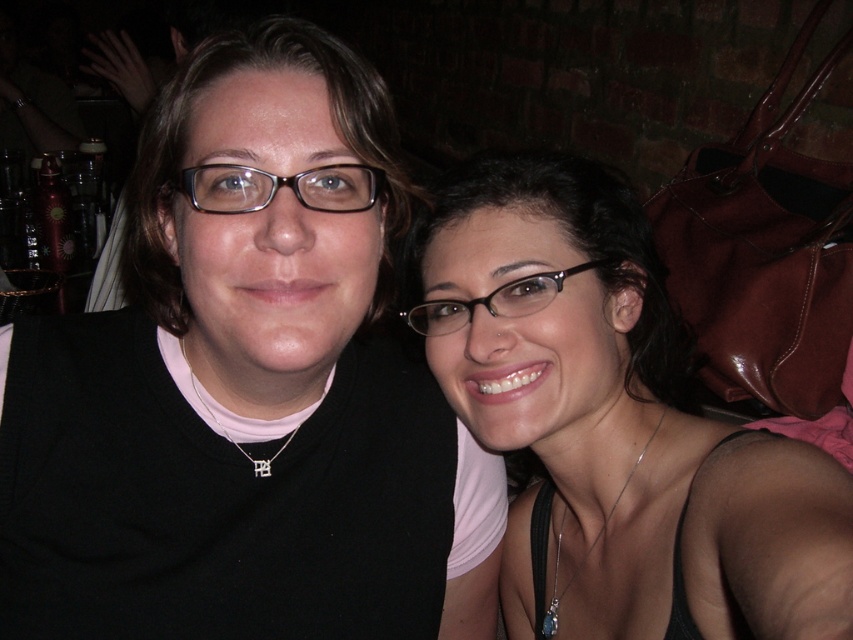
Can you confirm if matte black sweater at center is positioned to the right of silver/textured necklace at center?

Indeed, matte black sweater at center is positioned on the right side of silver/textured necklace at center.

Which of these two, matte black sweater at center or silver/textured necklace at center, stands shorter?

silver/textured necklace at center

Is point (322, 433) less distant than point (236, 442)?

That is False.

Identify the location of matte black sweater at center. The width and height of the screenshot is (853, 640). (239, 392).

Can you confirm if matte black sweater at center is positioned to the left of silver/glass pendant at center?

Indeed, matte black sweater at center is positioned on the left side of silver/glass pendant at center.

Does matte black sweater at center appear on the right side of silver/glass pendant at center?

No, matte black sweater at center is not to the right of silver/glass pendant at center.

Where is `matte black sweater at center`? matte black sweater at center is located at coordinates (239, 392).

What do you see at coordinates (495, 300) in the screenshot? This screenshot has width=853, height=640. I see `black plastic glasses at center` at bounding box center [495, 300].

What do you see at coordinates (495, 300) in the screenshot? I see `black plastic glasses at center` at bounding box center [495, 300].

The width and height of the screenshot is (853, 640). I want to click on black plastic glasses at center, so click(x=495, y=300).